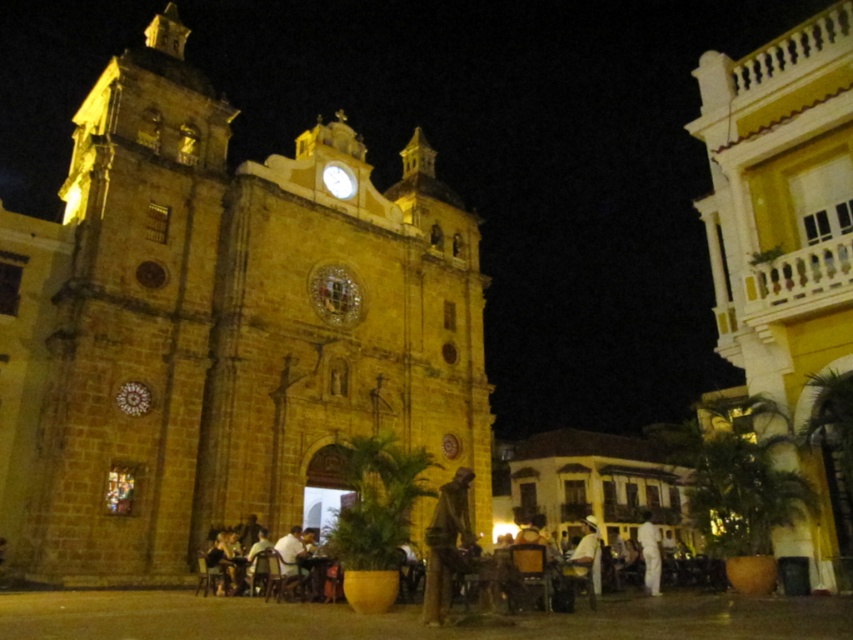
Question: Which point is closer to the camera?

Choices:
 (A) bronze statue at center
 (B) white fabric shirt at lower right

Answer: (A)

Question: Which object is positioned farthest from the golden stone church at center?

Choices:
 (A) white cotton pants at lower right
 (B) bronze statue at center

Answer: (A)

Question: Is golden stone church at center closer to camera compared to white fabric shirt at lower right?

Choices:
 (A) yes
 (B) no

Answer: (B)

Question: Does bronze statue at center appear on the right side of white fabric shirt at lower right?

Choices:
 (A) yes
 (B) no

Answer: (B)

Question: Which object appears farthest from the camera in this image?

Choices:
 (A) golden stone church at center
 (B) bronze statue at center
 (C) yellow stucco church at center

Answer: (A)

Question: Does golden stone church at center appear over white cotton pants at lower right?

Choices:
 (A) no
 (B) yes

Answer: (B)